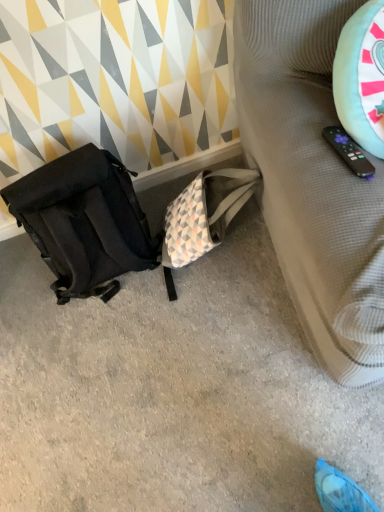
Image resolution: width=384 pixels, height=512 pixels. What do you see at coordinates (312, 181) in the screenshot? I see `textured beige sofa at right` at bounding box center [312, 181].

Find the location of a particular element. The height and width of the screenshot is (512, 384). black fabric backpack at left is located at coordinates (172, 391).

Is black fabric backpack at left in front of or behind textured beige sofa at right in the image?

Visually, black fabric backpack at left is located behind textured beige sofa at right.

Is black fabric backpack at left oriented away from textured beige sofa at right?

No, black fabric backpack at left is not facing the opposite direction of textured beige sofa at right.

How many degrees apart are the facing directions of black fabric backpack at left and textured beige sofa at right?

There is a 0.73-degree angle between the facing directions of black fabric backpack at left and textured beige sofa at right.

Considering the sizes of objects black fabric backpack at left and textured beige sofa at right in the image provided, who is smaller, black fabric backpack at left or textured beige sofa at right?

Smaller between the two is black fabric backpack at left.

The image size is (384, 512). Find the location of `furniture above the matte black backpack at left (from a real-world perspective)`. furniture above the matte black backpack at left (from a real-world perspective) is located at coordinates (312, 181).

In terms of size, does matte black backpack at left appear bigger or smaller than textured beige sofa at right?

In the image, matte black backpack at left appears to be smaller than textured beige sofa at right.

Measure the distance from matte black backpack at left to textured beige sofa at right.

matte black backpack at left is 20.75 inches from textured beige sofa at right.

Are textured beige sofa at right and matte black backpack at left beside each other?

textured beige sofa at right and matte black backpack at left are clearly separated.

Considering the relative sizes of textured beige sofa at right and matte black backpack at left in the image provided, is textured beige sofa at right wider than matte black backpack at left?

Indeed, textured beige sofa at right has a greater width compared to matte black backpack at left.

Which object is positioned more to the left, textured beige sofa at right or matte black backpack at left?

matte black backpack at left.

How many degrees apart are the facing directions of textured beige sofa at right and matte black backpack at left?

1.12 degrees separate the facing orientations of textured beige sofa at right and matte black backpack at left.

Is matte black backpack at left positioned with its back to black fabric backpack at left?

That's not correct — matte black backpack at left is not looking away from black fabric backpack at left.

Can you confirm if matte black backpack at left is taller than black fabric backpack at left?

Correct, matte black backpack at left is much taller as black fabric backpack at left.

Consider the image. Is matte black backpack at left far from black fabric backpack at left?

They are positioned close to each other.

From a real-world perspective, is matte black backpack at left located higher than black fabric backpack at left?

Yes, from a real-world perspective, matte black backpack at left is above black fabric backpack at left.

How different are the orientations of black fabric backpack at left and matte black backpack at left in degrees?

The angle between the facing direction of black fabric backpack at left and the facing direction of matte black backpack at left is 1.85 degrees.

Does black fabric backpack at left have a greater width compared to matte black backpack at left?

Indeed, black fabric backpack at left has a greater width compared to matte black backpack at left.

Can you see black fabric backpack at left touching matte black backpack at left?

No, black fabric backpack at left is not beside matte black backpack at left.

Which is behind, point (13, 438) or point (58, 181)?

The point (13, 438) is more distant.

Would you say textured beige sofa at right is outside black fabric backpack at left?

Yes.

From the image's perspective, is textured beige sofa at right on top of black fabric backpack at left?

Indeed, from the image's perspective, textured beige sofa at right is shown above black fabric backpack at left.

Which is less distant, (346, 239) or (224, 490)?

Point (346, 239) is closer to the camera than point (224, 490).

Locate an element on the screen. The width and height of the screenshot is (384, 512). furniture that is on the right side of black fabric backpack at left is located at coordinates (312, 181).

You are a GUI agent. You are given a task and a screenshot of the screen. Output one action in this format:
    pyautogui.click(x=<x>, y=<y>)
    Task: Click on the furniture above the matte black backpack at left (from the image's perspective)
    
    Given the screenshot: What is the action you would take?
    pyautogui.click(x=312, y=181)

Considering their positions, is black fabric backpack at left positioned closer to textured beige sofa at right than matte black backpack at left?

black fabric backpack at left is closer to textured beige sofa at right.

From the image, which object appears to be nearer to black fabric backpack at left, textured beige sofa at right or matte black backpack at left?

The object closer to black fabric backpack at left is matte black backpack at left.

Based on their spatial positions, is matte black backpack at left or black fabric backpack at left closer to textured beige sofa at right?

black fabric backpack at left is closer to textured beige sofa at right.

When comparing their distances from black fabric backpack at left, does matte black backpack at left or textured beige sofa at right seem further?

Based on the image, textured beige sofa at right appears to be further to black fabric backpack at left.

Consider the image. Estimate the real-world distances between objects in this image. Which object is closer to matte black backpack at left, black fabric backpack at left or textured beige sofa at right?

black fabric backpack at left lies closer to matte black backpack at left than the other object.

Looking at the image, which one is located closer to matte black backpack at left, textured beige sofa at right or black fabric backpack at left?

The object closer to matte black backpack at left is black fabric backpack at left.

Find the location of `concrete located between matte black backpack at left and textured beige sofa at right in the left-right direction`. concrete located between matte black backpack at left and textured beige sofa at right in the left-right direction is located at coordinates (172, 391).